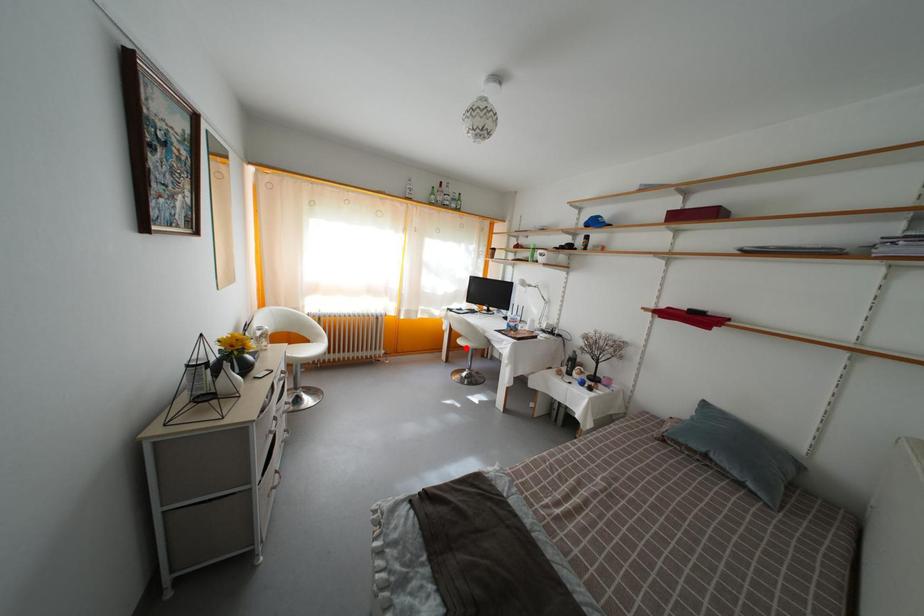
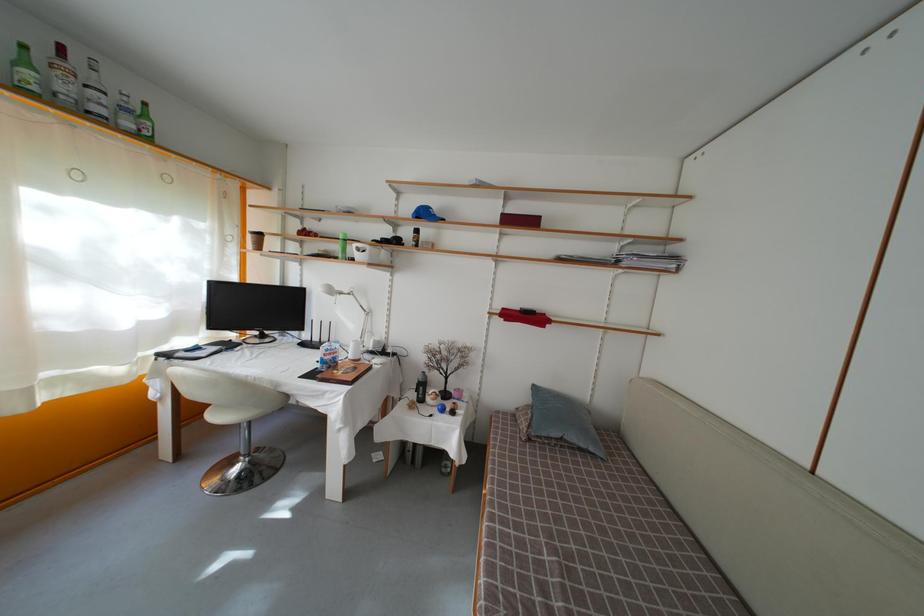
In the second image, find the point that corresponds to the highlighted location in the first image.

(221, 422)